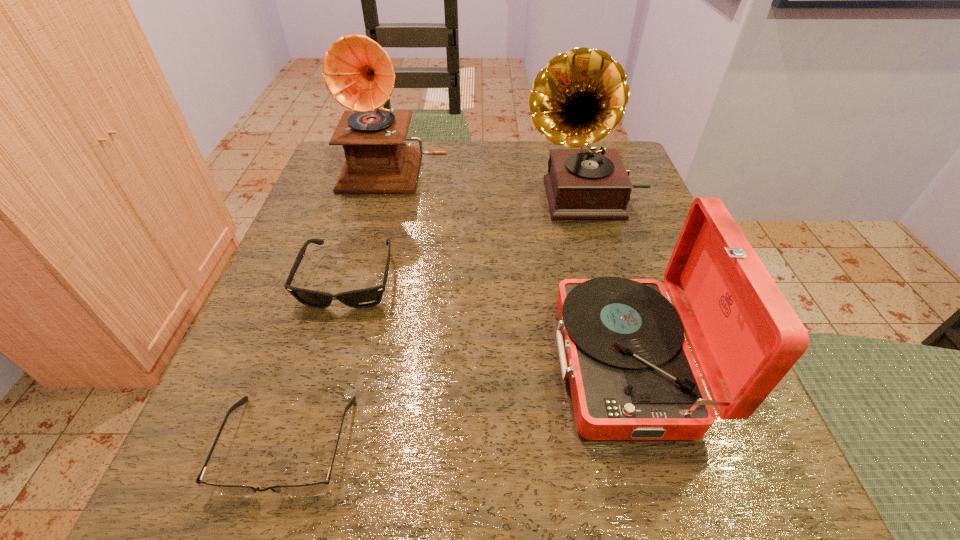
This screenshot has width=960, height=540. I want to click on phonograph_record that is at the near edge, so click(x=621, y=343).

The width and height of the screenshot is (960, 540). I want to click on spectacles that is positioned at the near edge, so click(315, 489).

Locate an element on the screen. The image size is (960, 540). phonograph record at the left edge is located at coordinates (358, 73).

Identify the location of sunglasses present at the left edge. The height and width of the screenshot is (540, 960). (362, 298).

Identify the location of spectacles that is at the left edge. (315, 489).

Image resolution: width=960 pixels, height=540 pixels. In order to click on object located in the far left corner section of the desktop in this screenshot , I will do `click(358, 73)`.

Where is `object at the near left corner`? object at the near left corner is located at coordinates (315, 489).

I want to click on object at the far right corner, so click(x=580, y=96).

I want to click on object located in the near right corner section of the desktop, so click(621, 343).

What are the coordinates of `vacant area at the far edge` in the screenshot? It's located at (426, 157).